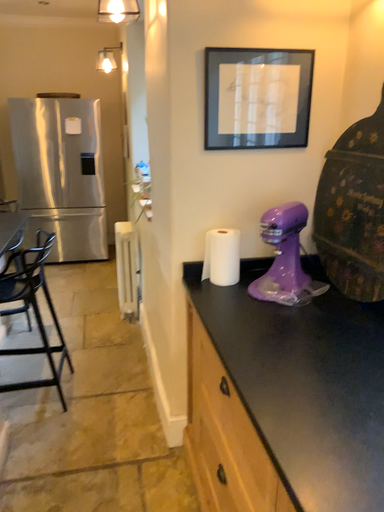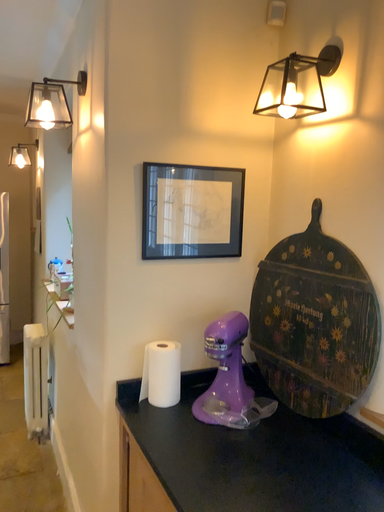
Question: Which way did the camera rotate in the video?

Choices:
 (A) rotated left
 (B) rotated right

Answer: (B)